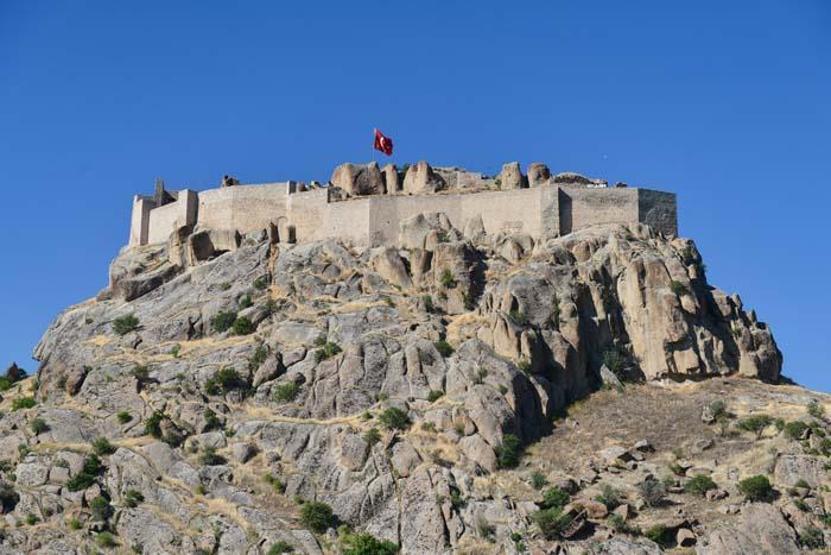
In order to click on wall in this screenshot , I will do `click(385, 223)`.